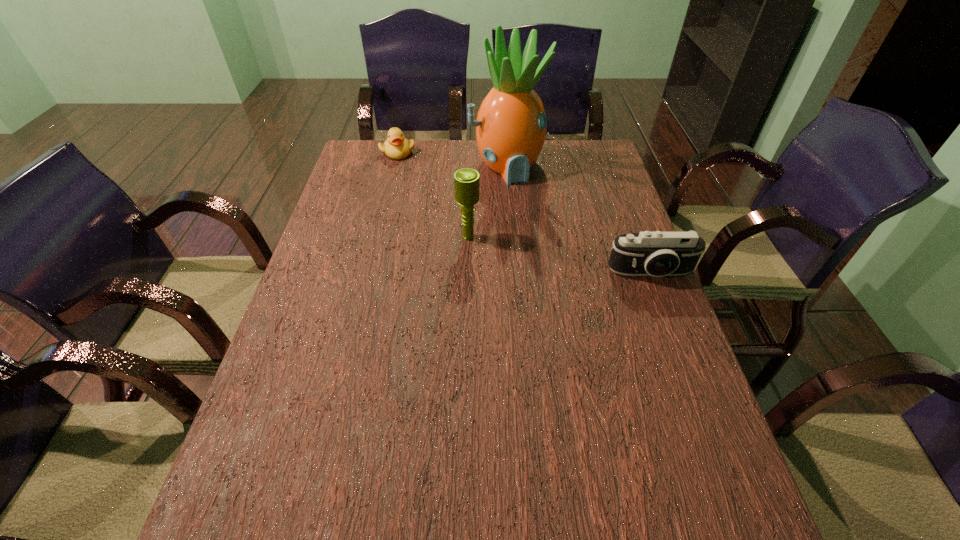
What are the coordinates of `free spot at the left edge of the desktop` in the screenshot? It's located at (331, 375).

In the image, there is a desktop. At what (x,y) coordinates should I click in order to perform the action: click on vacant space at the right edge. Please return your answer as a coordinate pair (x, y). The image size is (960, 540). Looking at the image, I should click on (629, 215).

The width and height of the screenshot is (960, 540). In order to click on vacant region at the far left corner of the desktop in this screenshot , I will do `click(358, 171)`.

This screenshot has width=960, height=540. Find the location of `vacant space at the far right corner of the desktop`. vacant space at the far right corner of the desktop is located at coordinates (560, 143).

Find the location of `vacant area that lies between the third farthest object and the rightmost object`. vacant area that lies between the third farthest object and the rightmost object is located at coordinates (560, 255).

Find the location of `free space that is in between the duckling and the tallest object`. free space that is in between the duckling and the tallest object is located at coordinates (452, 159).

Where is `vacant area that lies between the pineapple and the nearest object`? The width and height of the screenshot is (960, 540). vacant area that lies between the pineapple and the nearest object is located at coordinates (579, 219).

Where is `free spot between the third farthest object and the rightmost object`? This screenshot has height=540, width=960. free spot between the third farthest object and the rightmost object is located at coordinates (560, 255).

Find the location of a particular element. free space that is in between the nearest object and the pineapple is located at coordinates (579, 219).

Where is `unoccupied area between the tallest object and the camera`? unoccupied area between the tallest object and the camera is located at coordinates (579, 219).